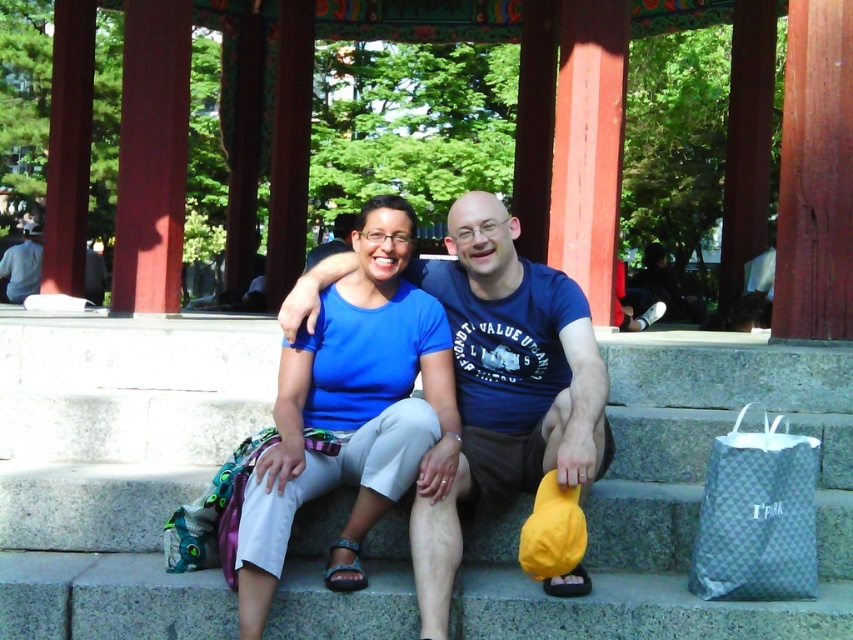
Is blue cotton t-shirt at center closer to the viewer compared to gray woven fabric bag at lower right?

No.

Is blue cotton t-shirt at center to the right of gray woven fabric bag at lower right from the viewer's perspective?

Incorrect, blue cotton t-shirt at center is not on the right side of gray woven fabric bag at lower right.

Measure the distance between point (x=573, y=365) and camera.

Point (x=573, y=365) is 6.61 meters from camera.

You are a GUI agent. You are given a task and a screenshot of the screen. Output one action in this format:
    pyautogui.click(x=<x>, y=<y>)
    Task: Click on the blue cotton t-shirt at center
    
    Given the screenshot: What is the action you would take?
    pyautogui.click(x=505, y=387)

Between blue fabric shirt at center and gray woven fabric bag at lower right, which one has less height?

Standing shorter between the two is gray woven fabric bag at lower right.

Between blue fabric shirt at center and gray woven fabric bag at lower right, which one appears on the left side from the viewer's perspective?

Positioned to the left is blue fabric shirt at center.

The height and width of the screenshot is (640, 853). Describe the element at coordinates (352, 412) in the screenshot. I see `blue fabric shirt at center` at that location.

Locate an element on the screen. blue fabric shirt at center is located at coordinates (352, 412).

Which of these two, blue fabric shirt at center or denim pants at lower left, stands taller?

Standing taller between the two is denim pants at lower left.

Who is more distant from viewer, (329, 316) or (21, 298)?

The point (21, 298) is behind.

Image resolution: width=853 pixels, height=640 pixels. What are the coordinates of `blue fabric shirt at center` in the screenshot? It's located at (352, 412).